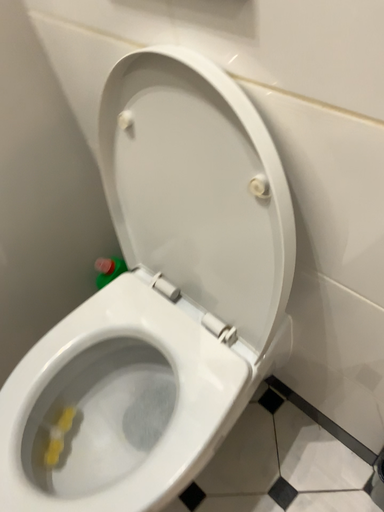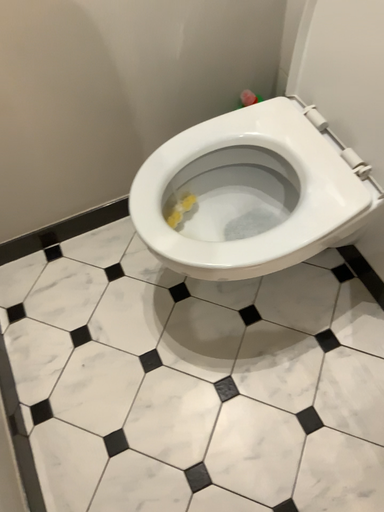
Question: Which way did the camera rotate in the video?

Choices:
 (A) rotated downward
 (B) rotated upward

Answer: (A)